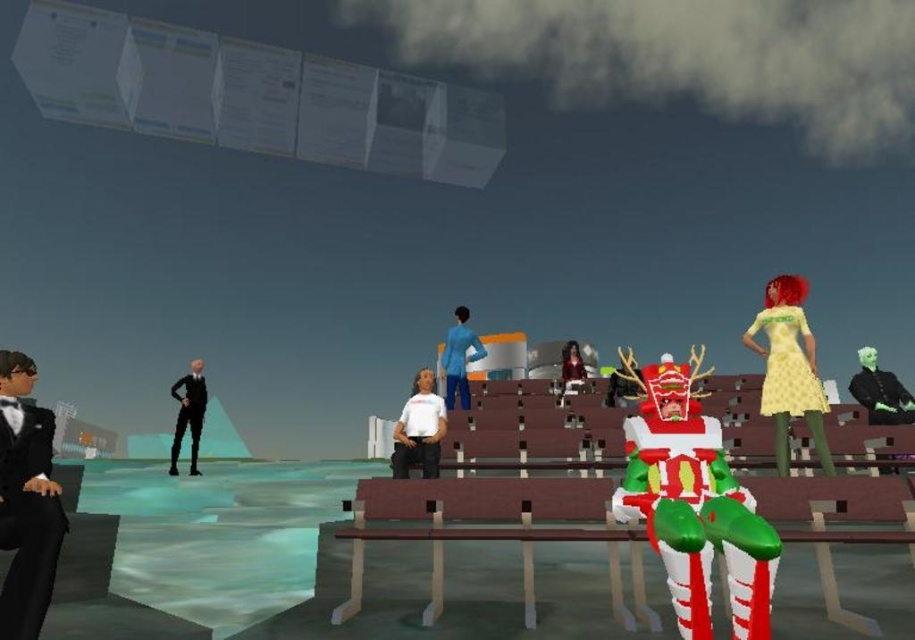
You are standing at the point marked as point (899, 400) in the image. You want to look up at the sky. Is the sky visible from your current position?

Yes, the sky is visible from point (899, 400) because the scene description mentions a dark and cloudy sky above the stage area, and there are no objects blocking the view in the foreground or background according to the provided information.